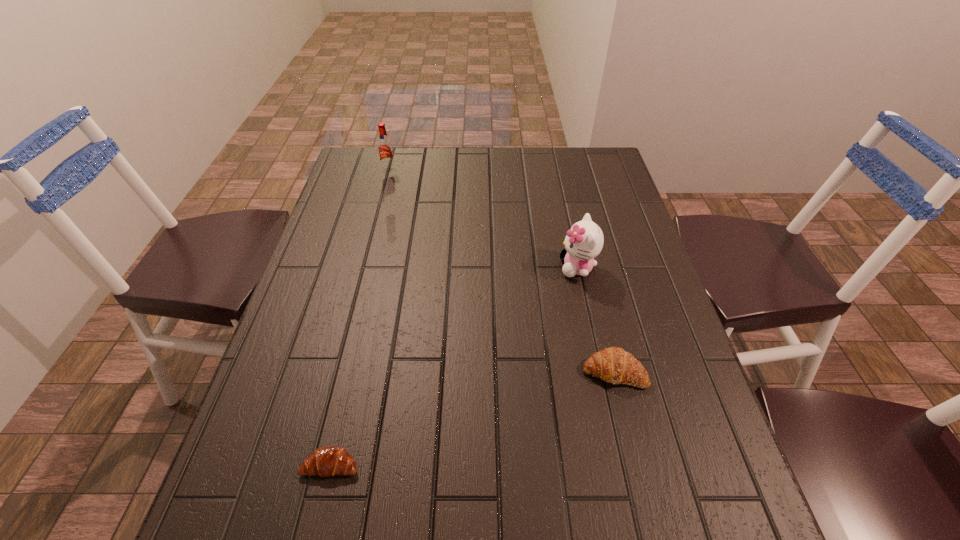
I want to click on free space that is in between the second farthest object and the taller crescent roll, so click(x=595, y=319).

Find the location of a particular element. Image resolution: width=960 pixels, height=540 pixels. vacant point located between the third nearest object and the right crescent roll is located at coordinates (595, 319).

Identify the location of empty space that is in between the farther crescent roll and the kitten. The image size is (960, 540). (595, 319).

Identify the location of object that is the second nearest to the second farthest object. This screenshot has width=960, height=540. (326, 461).

Find the location of a particular element. This screenshot has height=540, width=960. object that is the closest to the kitten is located at coordinates (613, 365).

I want to click on free region that satisfies the following two spatial constraints: 1. on the front-facing side of the taller crescent roll; 2. on the left side of the third nearest object, so click(x=600, y=372).

Where is `free spot that satisfies the following two spatial constraints: 1. on the front-facing side of the kitten; 2. on the right side of the taller crescent roll`? This screenshot has width=960, height=540. free spot that satisfies the following two spatial constraints: 1. on the front-facing side of the kitten; 2. on the right side of the taller crescent roll is located at coordinates (600, 372).

This screenshot has width=960, height=540. I want to click on free space that satisfies the following two spatial constraints: 1. on the front-facing side of the farther crescent roll; 2. on the left side of the kitten, so click(x=600, y=372).